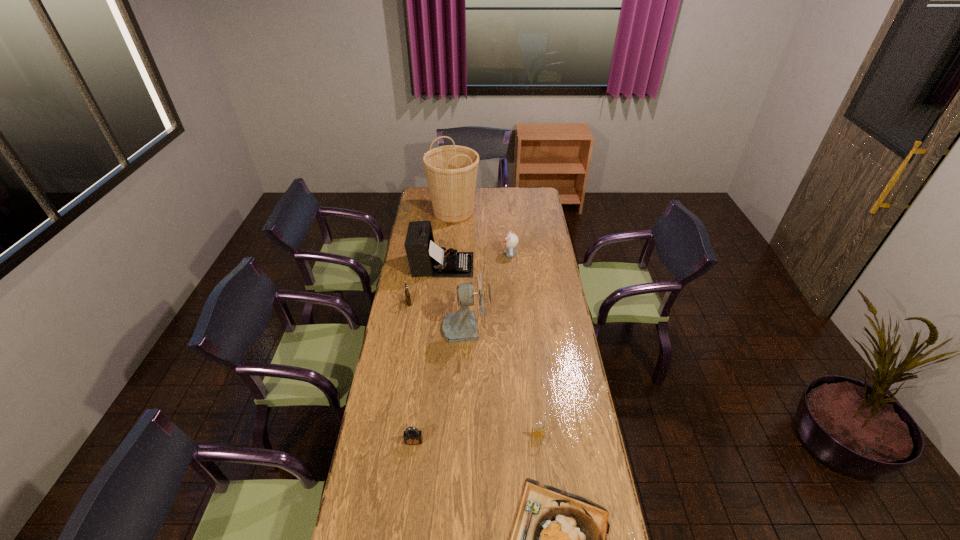
Find the location of `object that stands as the fifth closest to the nearest object`. object that stands as the fifth closest to the nearest object is located at coordinates (425, 258).

Find the location of a particular element. The image size is (960, 540). padlock that stands as the closest to the farthest padlock is located at coordinates (412, 436).

I want to click on the closest padlock to the typewriter, so click(407, 295).

Identify the location of free location that satisfies the following two spatial constraints: 1. in front of the fan to blow air; 2. on the front of the second padlock from right to left near the keyhole. Image resolution: width=960 pixels, height=540 pixels. [x=463, y=441].

Where is `vacant space that satisfies the following two spatial constraints: 1. in front of the second tallest object to blow air; 2. on the front of the second padlock from right to left near the keyhole`? vacant space that satisfies the following two spatial constraints: 1. in front of the second tallest object to blow air; 2. on the front of the second padlock from right to left near the keyhole is located at coordinates (463, 441).

Where is `blank area in the image that satisfies the following two spatial constraints: 1. in front of the fan to blow air; 2. on the front of the second padlock from right to left near the keyhole`? blank area in the image that satisfies the following two spatial constraints: 1. in front of the fan to blow air; 2. on the front of the second padlock from right to left near the keyhole is located at coordinates (463, 441).